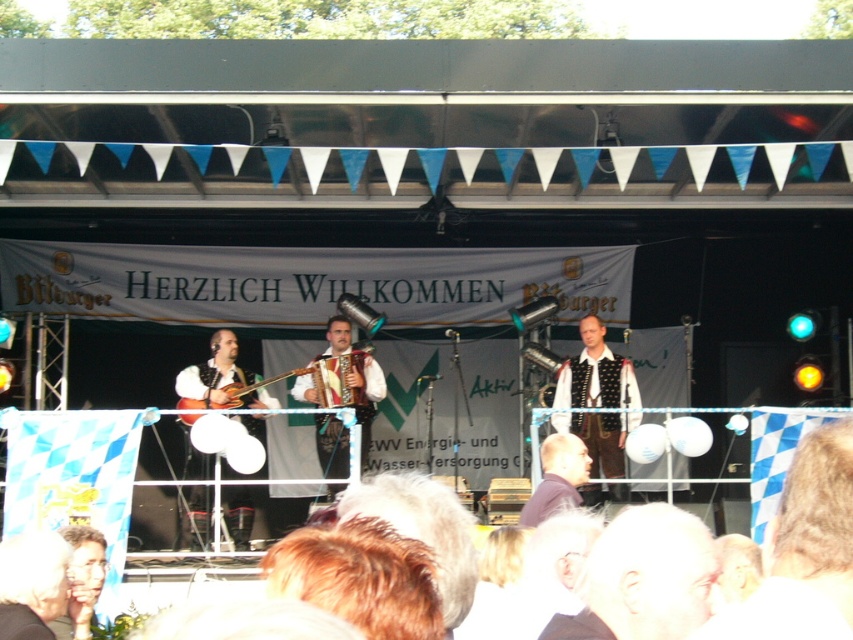
Question: Is brown leather vest at center above light brown hair at lower left?

Choices:
 (A) yes
 (B) no

Answer: (A)

Question: Which point is closer to the camera?

Choices:
 (A) (550, 508)
 (B) (564, 381)
 (C) (328, 330)
 (D) (212, 396)

Answer: (A)

Question: Observing the image, what is the correct spatial positioning of brown leather vest at center in reference to dark brown leather jacket at center?

Choices:
 (A) above
 (B) below

Answer: (A)

Question: Does matte brown guitar at left appear on the right side of light brown hair at lower left?

Choices:
 (A) yes
 (B) no

Answer: (A)

Question: Among these points, which one is nearest to the camera?

Choices:
 (A) (613, 364)
 (B) (556, 440)

Answer: (B)

Question: Which object is farther from the camera taking this photo?

Choices:
 (A) brown leather vest at center
 (B) matte brown guitar at left
 (C) dark brown leather jacket at center
 (D) leather-like brown accordion at center

Answer: (D)